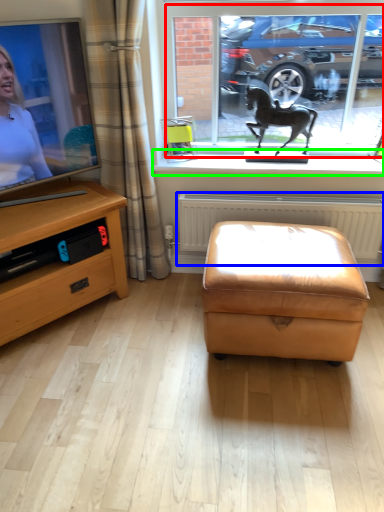
Question: Estimate the real-world distances between objects in this image. Which object is closer to window frame (highlighted by a red box), radiator (highlighted by a blue box) or window sill (highlighted by a green box)?

Choices:
 (A) radiator
 (B) window sill

Answer: (B)